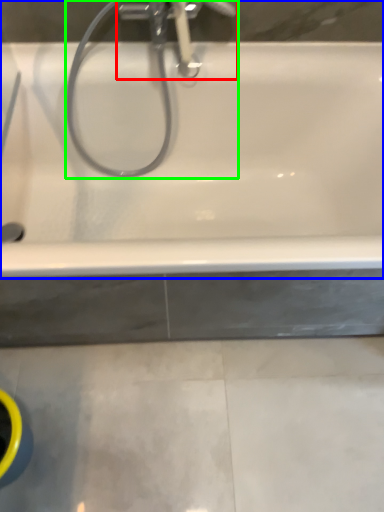
Question: Which object is the farthest from tap (highlighted by a red box)? Choose among these: bathtub (highlighted by a blue box) or plumbing fixture (highlighted by a green box).

Choices:
 (A) bathtub
 (B) plumbing fixture

Answer: (A)